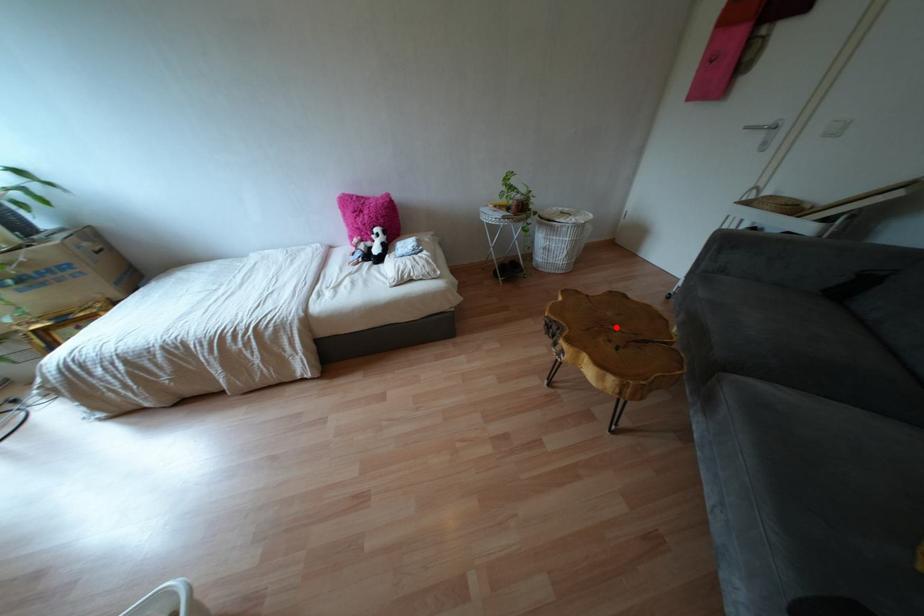
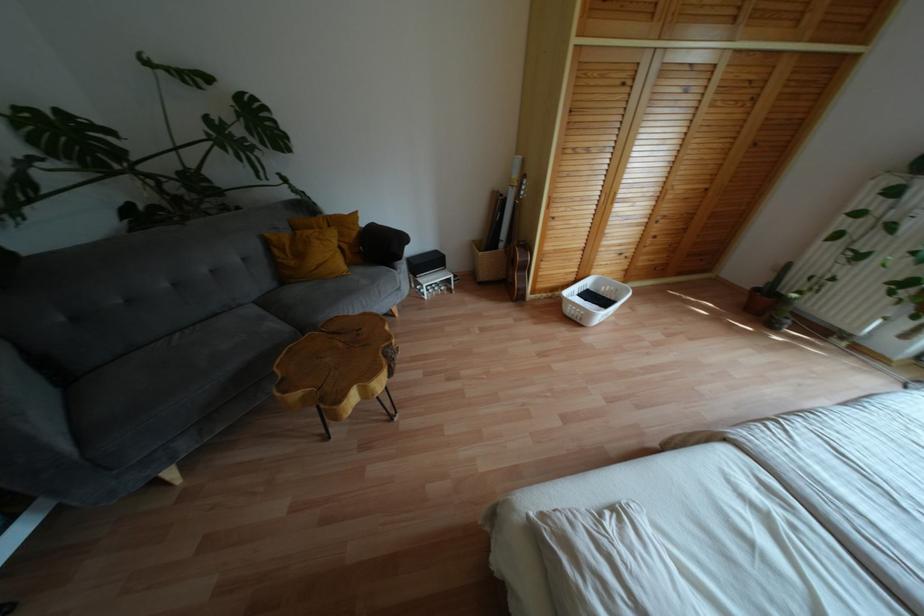
In the second image, find the point that corresponds to the highlighted location in the first image.

(341, 344)